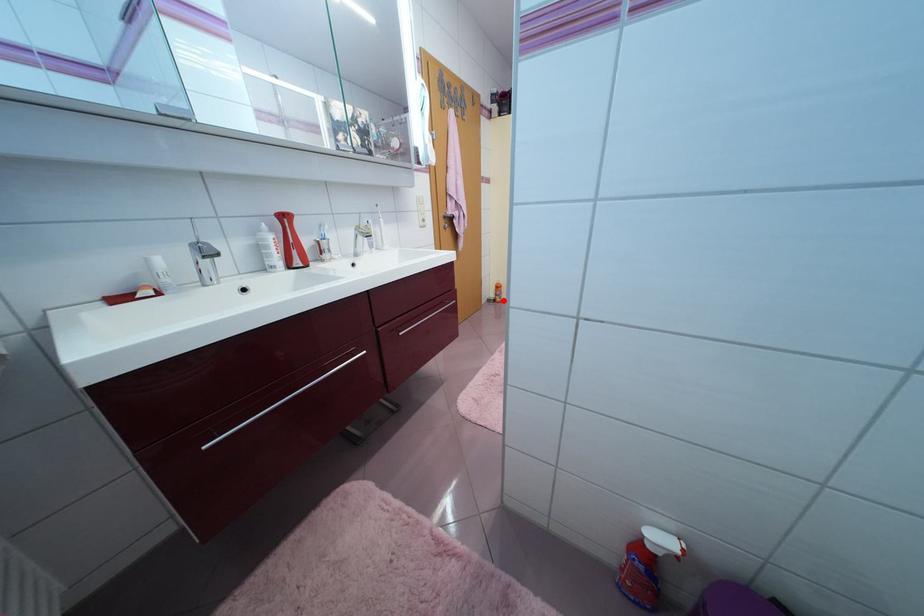
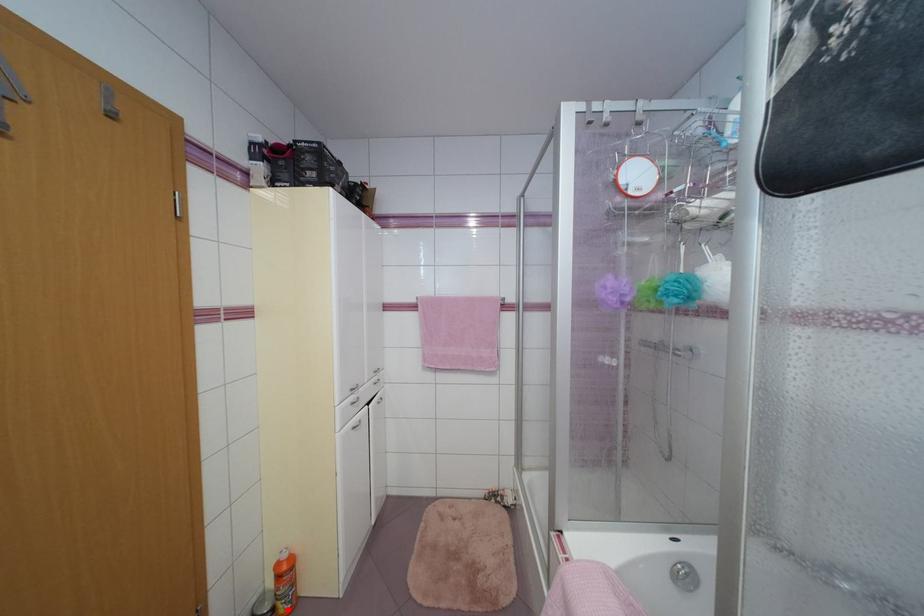
I am providing you with two images of the same scene from different viewpoints. A red point is marked on the first image and another point is marked on the second image. Are the points marked in image1 and image2 representing the same 3D position?

Yes